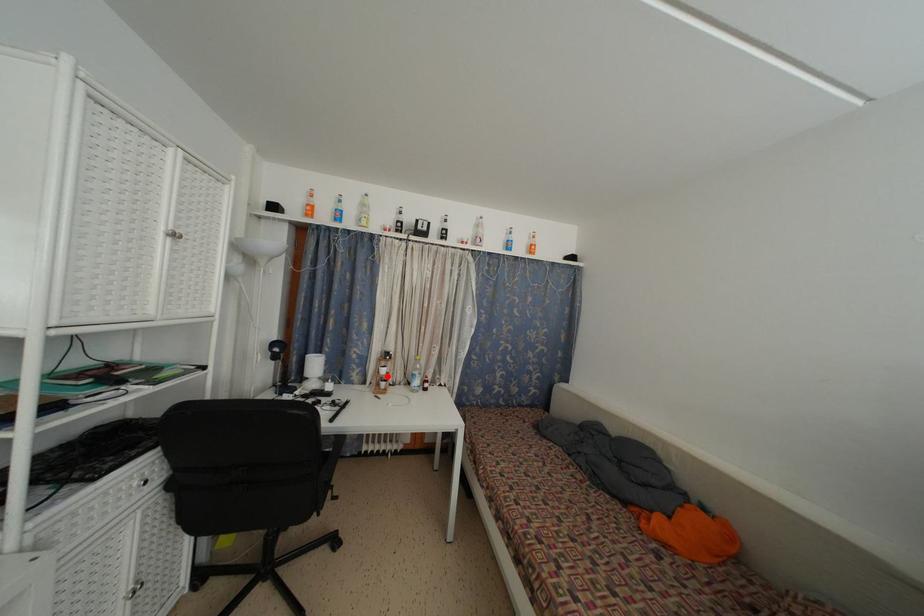
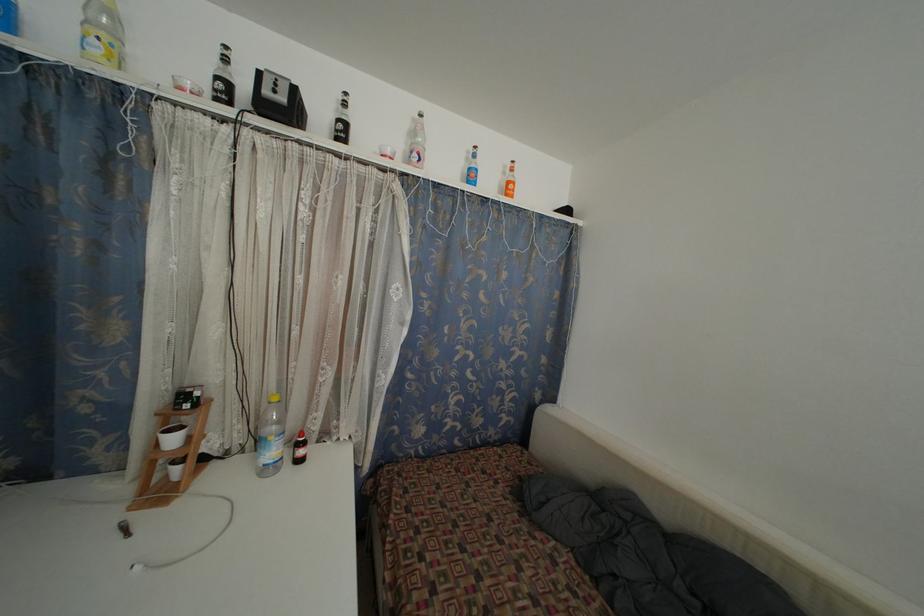
The point at the highlighted location is marked in the first image. Where is the corresponding point in the second image?

(176, 446)